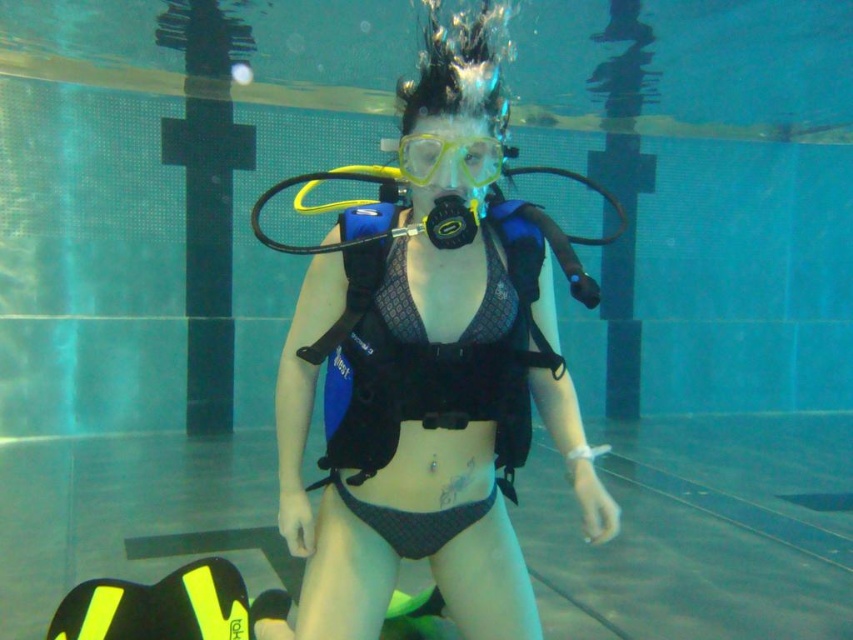
Is matte blue scuba vest at center to the right of black mesh bikini at center from the viewer's perspective?

Correct, you'll find matte blue scuba vest at center to the right of black mesh bikini at center.

You are a GUI agent. You are given a task and a screenshot of the screen. Output one action in this format:
    pyautogui.click(x=<x>, y=<y>)
    Task: Click on the matte blue scuba vest at center
    The height and width of the screenshot is (640, 853).
    Given the screenshot: What is the action you would take?
    pyautogui.click(x=427, y=376)

Describe the element at coordinates (427, 376) in the screenshot. I see `matte blue scuba vest at center` at that location.

You are a GUI agent. You are given a task and a screenshot of the screen. Output one action in this format:
    pyautogui.click(x=<x>, y=<y>)
    Task: Click on the matte blue scuba vest at center
    
    Given the screenshot: What is the action you would take?
    pyautogui.click(x=427, y=376)

Between black mesh bikini at center and yellow matte/glossy goggles at center, which one appears on the right side from the viewer's perspective?

From the viewer's perspective, yellow matte/glossy goggles at center appears more on the right side.

In the scene shown: Is black mesh bikini at center above yellow matte/glossy goggles at center?

No, black mesh bikini at center is not above yellow matte/glossy goggles at center.

Where is `black mesh bikini at center`? black mesh bikini at center is located at coordinates (428, 374).

Does matte blue scuba vest at center appear over yellow matte/glossy goggles at center?

Actually, matte blue scuba vest at center is below yellow matte/glossy goggles at center.

Can you confirm if matte blue scuba vest at center is wider than yellow matte/glossy goggles at center?

Yes, matte blue scuba vest at center is wider than yellow matte/glossy goggles at center.

Locate an element on the screen. matte blue scuba vest at center is located at coordinates (427, 376).

Find the location of `matte blue scuba vest at center`. matte blue scuba vest at center is located at coordinates (427, 376).